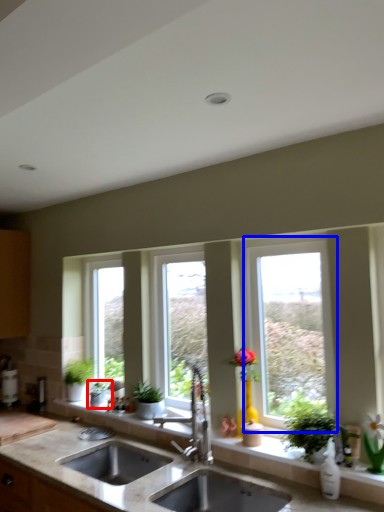
Question: Which of the following is the closest to the observer, houseplant (highlighted by a red box) or window (highlighted by a blue box)?

Choices:
 (A) houseplant
 (B) window

Answer: (B)